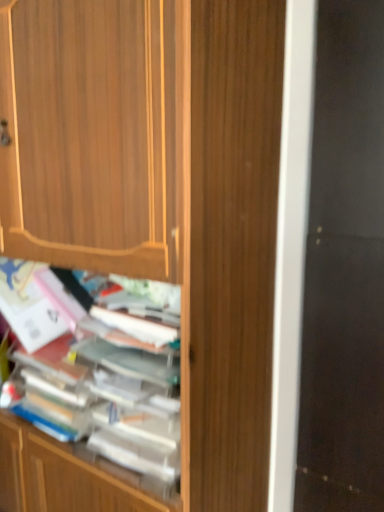
Question: Does wooden books at center lie behind black glass screen door at right?

Choices:
 (A) no
 (B) yes

Answer: (A)

Question: Is wooden books at center facing towards black glass screen door at right?

Choices:
 (A) yes
 (B) no

Answer: (B)

Question: Does wooden books at center have a larger size compared to black glass screen door at right?

Choices:
 (A) yes
 (B) no

Answer: (B)

Question: From the image's perspective, is wooden books at center beneath black glass screen door at right?

Choices:
 (A) no
 (B) yes

Answer: (B)

Question: Is the position of wooden books at center less distant than that of black glass screen door at right?

Choices:
 (A) yes
 (B) no

Answer: (A)

Question: Is wooden books at center to the left or to the right of wooden cabinet at center in the image?

Choices:
 (A) left
 (B) right

Answer: (B)

Question: Is point (56, 295) positioned closer to the camera than point (160, 154)?

Choices:
 (A) closer
 (B) farther

Answer: (B)

Question: In the image, is wooden books at center positioned in front of or behind wooden cabinet at center?

Choices:
 (A) behind
 (B) front

Answer: (A)

Question: Is wooden books at center inside the boundaries of wooden cabinet at center, or outside?

Choices:
 (A) outside
 (B) inside

Answer: (B)

Question: Is wooden books at center taller or shorter than black glass screen door at right?

Choices:
 (A) short
 (B) tall

Answer: (A)

Question: Is point (97, 498) closer or farther from the camera than point (336, 65)?

Choices:
 (A) farther
 (B) closer

Answer: (B)

Question: Would you say wooden books at center is inside or outside black glass screen door at right?

Choices:
 (A) inside
 (B) outside

Answer: (B)

Question: In terms of size, does wooden books at center appear bigger or smaller than black glass screen door at right?

Choices:
 (A) small
 (B) big

Answer: (A)

Question: Relative to wooden books at center, is wooden cabinet at center in front or behind?

Choices:
 (A) front
 (B) behind

Answer: (A)

Question: From the image's perspective, is wooden cabinet at center above or below wooden books at center?

Choices:
 (A) below
 (B) above

Answer: (A)